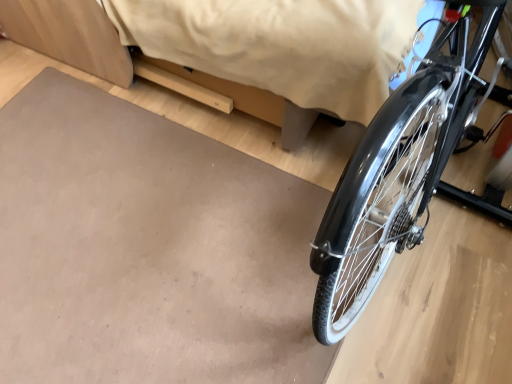
Identify the location of matte beige bed at upper center. (139, 62).

What do you see at coordinates (139, 62) in the screenshot?
I see `matte beige bed at upper center` at bounding box center [139, 62].

Image resolution: width=512 pixels, height=384 pixels. Describe the element at coordinates (147, 249) in the screenshot. I see `matte gray mat at lower right` at that location.

You are a GUI agent. You are given a task and a screenshot of the screen. Output one action in this format:
    pyautogui.click(x=<x>, y=<y>)
    Task: Click on the matte gray mat at lower right
    The image size is (512, 384).
    Given the screenshot: What is the action you would take?
    pyautogui.click(x=147, y=249)

Find the location of a particular element. This screenshot has width=512, height=384. matte beige bed at upper center is located at coordinates (139, 62).

Is matte gray mat at lower right at the right side of matte beige bed at upper center?

No.

Considering their positions, is matte gray mat at lower right located in front of or behind matte beige bed at upper center?

matte gray mat at lower right is behind matte beige bed at upper center.

Which is nearer, (281,335) or (147,65)?

Point (281,335)

From the image's perspective, between matte gray mat at lower right and matte beige bed at upper center, who is located below?

matte gray mat at lower right is shown below in the image.

From a real-world perspective, is matte gray mat at lower right positioned under matte beige bed at upper center based on gravity?

Yes.

Can you confirm if matte gray mat at lower right is wider than matte beige bed at upper center?

Incorrect, the width of matte gray mat at lower right does not surpass that of matte beige bed at upper center.

Based on the photo, considering the relative sizes of matte gray mat at lower right and matte beige bed at upper center in the image provided, is matte gray mat at lower right taller than matte beige bed at upper center?

No.

Who is bigger, matte gray mat at lower right or matte beige bed at upper center?

matte beige bed at upper center is bigger.

Is matte gray mat at lower right located outside matte beige bed at upper center?

Yes, matte gray mat at lower right is located beyond the bounds of matte beige bed at upper center.

Are matte gray mat at lower right and matte beige bed at upper center making contact?

No, matte gray mat at lower right is not making contact with matte beige bed at upper center.

Is matte gray mat at lower right facing away from matte beige bed at upper center?

That's not correct — matte gray mat at lower right is not looking away from matte beige bed at upper center.

Find the location of a particular element. slate behind the matte beige bed at upper center is located at coordinates (147, 249).

Which is more to the left, matte beige bed at upper center or matte gray mat at lower right?

Positioned to the left is matte gray mat at lower right.

Considering the positions of objects matte beige bed at upper center and matte gray mat at lower right in the image provided, who is in front, matte beige bed at upper center or matte gray mat at lower right?

matte beige bed at upper center is more forward.

Which is farther from the camera, (159, 76) or (266, 333)?

The point (159, 76) is farther.

From the image's perspective, is matte beige bed at upper center on top of matte gray mat at lower right?

Yes, from the image's perspective, matte beige bed at upper center is over matte gray mat at lower right.

From a real-world perspective, is matte beige bed at upper center below matte gray mat at lower right?

Actually, matte beige bed at upper center is physically above matte gray mat at lower right in the real world.

Which of these two, matte beige bed at upper center or matte gray mat at lower right, is wider?

matte beige bed at upper center is wider.

In terms of height, does matte beige bed at upper center look taller or shorter compared to matte gray mat at lower right?

matte beige bed at upper center is taller than matte gray mat at lower right.

Which of these two, matte beige bed at upper center or matte gray mat at lower right, is bigger?

Result: matte beige bed at upper center.

Is matte gray mat at lower right surrounded by matte beige bed at upper center?

Definitely not — matte gray mat at lower right is not inside matte beige bed at upper center.

Is matte beige bed at upper center next to matte gray mat at lower right?

No, matte beige bed at upper center is not with matte gray mat at lower right.

Is matte beige bed at upper center aimed at matte gray mat at lower right?

No, matte beige bed at upper center is not turned towards matte gray mat at lower right.

Locate an element on the screen. The width and height of the screenshot is (512, 384). bed on the right of matte gray mat at lower right is located at coordinates (139, 62).

The height and width of the screenshot is (384, 512). What are the coordinates of `slate located behind the matte beige bed at upper center` in the screenshot? It's located at (147, 249).

This screenshot has height=384, width=512. In order to click on slate located below the matte beige bed at upper center (from the image's perspective) in this screenshot , I will do [147, 249].